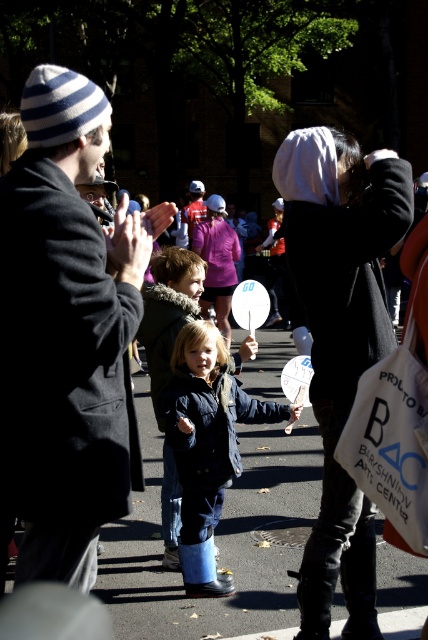
Question: Which object is closer to the camera taking this photo?

Choices:
 (A) dark blue jacket at center
 (B) striped knit hat at upper left
 (C) matte red helmet at center

Answer: (B)

Question: Does black fabric coat at center appear under matte red helmet at center?

Choices:
 (A) no
 (B) yes

Answer: (B)

Question: Which of the following is the closest to the observer?

Choices:
 (A) (195, 208)
 (B) (169, 362)
 (C) (89, 326)
 (D) (296, 145)

Answer: (C)

Question: Which point appears closest to the camera in this image?

Choices:
 (A) (183, 227)
 (B) (297, 189)

Answer: (B)

Question: Is striped knit hat at upper left positioned before dark blue denim jacket at center?

Choices:
 (A) yes
 (B) no

Answer: (A)

Question: Is dark blue jacket at center wider than matte red helmet at center?

Choices:
 (A) no
 (B) yes

Answer: (A)